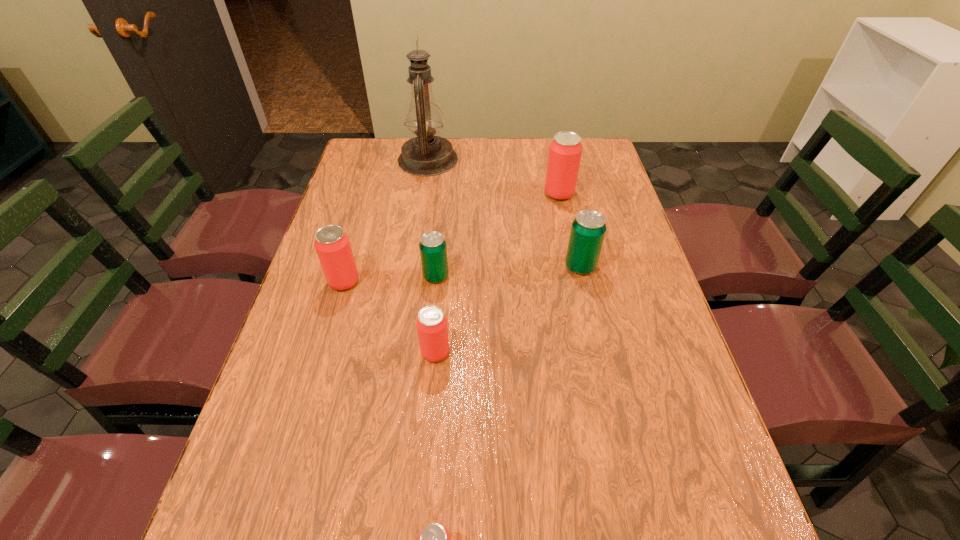
I want to click on vacant space located on the left of the oil lamp, so click(372, 159).

You are a GUI agent. You are given a task and a screenshot of the screen. Output one action in this format:
    pyautogui.click(x=<x>, y=<y>)
    Task: Click on the free region located on the back of the tallest beer can
    The height and width of the screenshot is (540, 960).
    Given the screenshot: What is the action you would take?
    555,172

Where is `free space located on the front of the leftmost red beer can`? free space located on the front of the leftmost red beer can is located at coordinates (315, 379).

Find the location of a particular element. This screenshot has height=540, width=960. vacant space located 0.360m on the front of the right teal beer can is located at coordinates (611, 402).

This screenshot has height=540, width=960. I want to click on vacant area situated on the back of the smaller teal beer can, so click(x=439, y=245).

The image size is (960, 540). Identify the location of blank area located on the back of the fifth farthest beer can. (442, 279).

Identify the location of object that is positioned at the far edge. (425, 155).

At what (x,y) coordinates should I click in order to perform the action: click on oil lamp that is positioned at the left edge. Please return your answer as a coordinate pair (x, y). Image resolution: width=960 pixels, height=540 pixels. Looking at the image, I should click on (425, 155).

The width and height of the screenshot is (960, 540). What are the coordinates of `beer can that is positioned at the left edge` in the screenshot? It's located at (332, 244).

At what (x,y) coordinates should I click in order to perform the action: click on object at the far left corner. Please return your answer as a coordinate pair (x, y). Looking at the image, I should click on (425, 155).